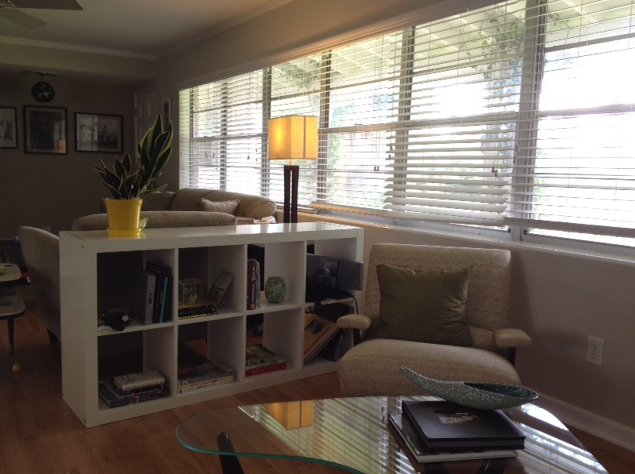
The width and height of the screenshot is (635, 474). Identify the location of ceiling fan. pyautogui.click(x=23, y=18).